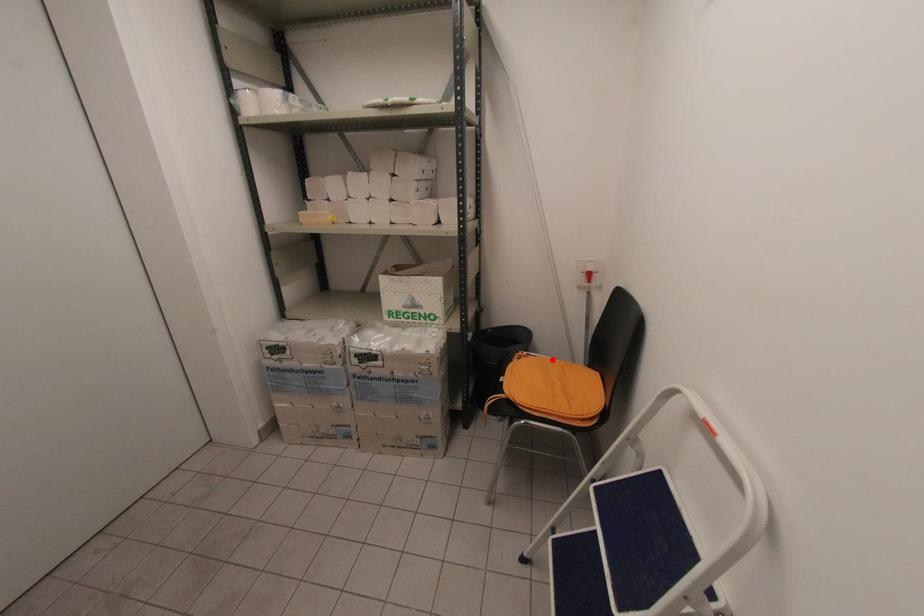
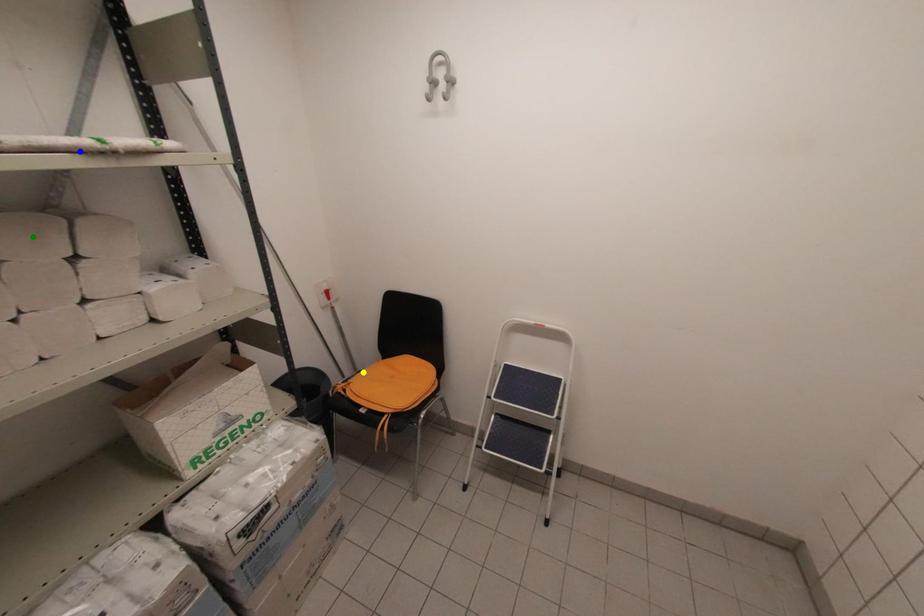
Question: I am providing you with two images of the same scene from different viewpoints. A red point is marked on the first image. You are given multiple points on the second image. Which point in image 2 is actually the same real-world point as the red point in image 1?

Choices:
 (A) green point
 (B) yellow point
 (C) blue point

Answer: (B)